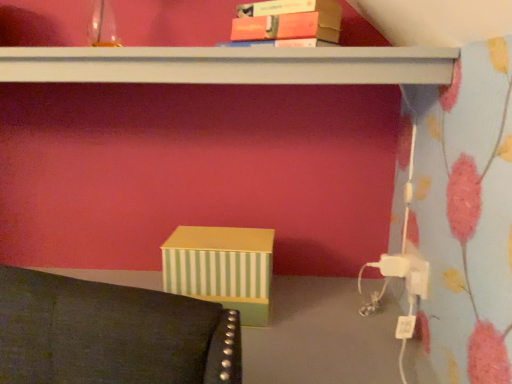
Question: Choose the correct answer: Is matte orange book at upper center inside white matte shelf at upper center or outside it?

Choices:
 (A) inside
 (B) outside

Answer: (B)

Question: Does point (280, 9) appear closer or farther from the camera than point (273, 67)?

Choices:
 (A) closer
 (B) farther

Answer: (B)

Question: Considering the real-world distances, which object is closest to the matte orange book at upper center?

Choices:
 (A) white matte shelf at upper center
 (B) white plastic plug at lower right

Answer: (A)

Question: Which object is positioned farthest from the white plastic plug at lower right?

Choices:
 (A) white matte shelf at upper center
 (B) matte orange book at upper center

Answer: (B)